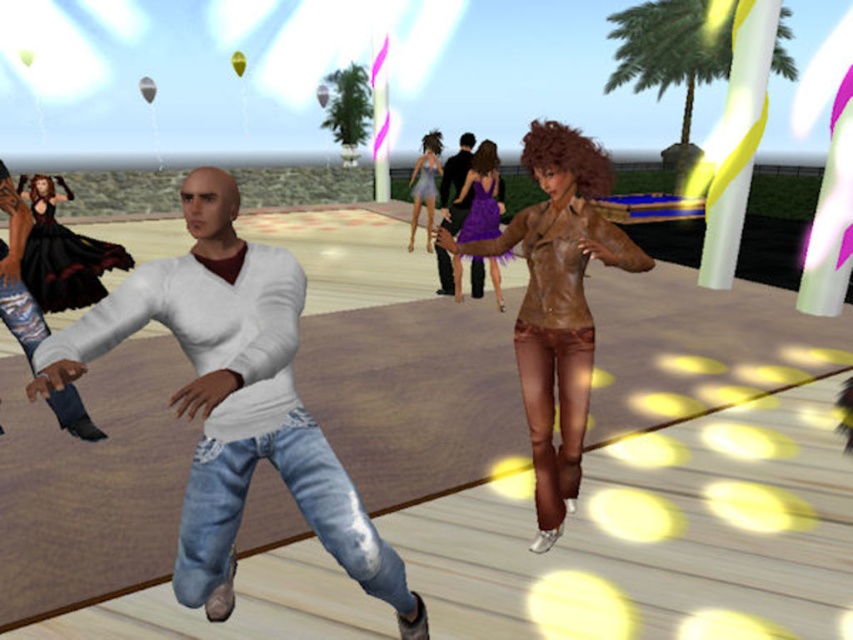
Question: Can you confirm if white matte shirt at center is positioned above shiny silver dress at center?

Choices:
 (A) yes
 (B) no

Answer: (B)

Question: Estimate the real-world distances between objects in this image. Which object is farther from the white matte shirt at center?

Choices:
 (A) shiny silver dress at center
 (B) brown leather jacket at center
 (C) black satin dress at left
 (D) shiny purple dress at center

Answer: (A)

Question: Which object is farther from the camera taking this photo?

Choices:
 (A) shiny silver dress at center
 (B) black satin dress at left
 (C) shiny purple dress at center
 (D) matte white sweater at center

Answer: (A)

Question: Is brown leather jacket at center closer to the viewer compared to matte white sweater at center?

Choices:
 (A) yes
 (B) no

Answer: (A)

Question: Is white matte shirt at center to the right of black satin dress at left from the viewer's perspective?

Choices:
 (A) yes
 (B) no

Answer: (A)

Question: Which of the following is the farthest from the observer?

Choices:
 (A) brown leather jacket at center
 (B) white matte shirt at center
 (C) matte white sweater at center
 (D) shiny purple dress at center

Answer: (D)